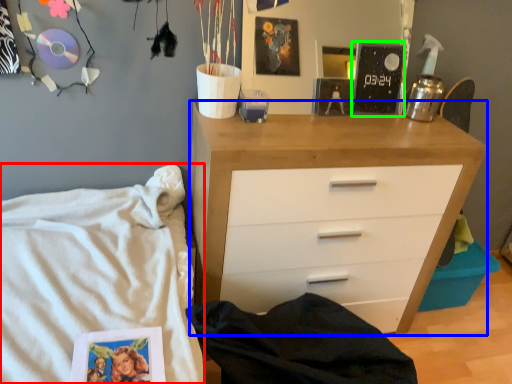
Question: Estimate the real-world distances between objects in this image. Which object is closer to bed (highlighted by a red box), chest of drawers (highlighted by a blue box) or magazine (highlighted by a green box)?

Choices:
 (A) chest of drawers
 (B) magazine

Answer: (A)